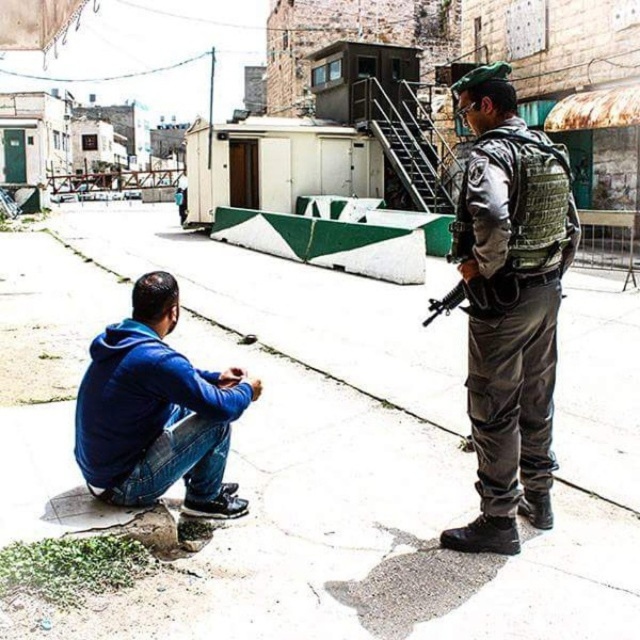
Which is below, smooth concrete pavement at center or camouflage fabric uniform at center?

camouflage fabric uniform at center

Can you confirm if smooth concrete pavement at center is smaller than camouflage fabric uniform at center?

No, smooth concrete pavement at center is not smaller than camouflage fabric uniform at center.

Is point (612, 360) more distant than point (474, 403)?

Yes, it is.

Where is `smooth concrete pavement at center`? smooth concrete pavement at center is located at coordinates (324, 448).

Is camouflage fabric uniform at center positioned at the back of blue fleece jacket at lower left?

No, it is in front of blue fleece jacket at lower left.

Is point (490, 188) more distant than point (234, 499)?

No.

Does point (541, 518) lie in front of point (198, 390)?

No, it is behind (198, 390).

Find the location of `camouflage fabric uniform at center`. camouflage fabric uniform at center is located at coordinates (509, 305).

Is smooth concrete pavement at center bigger than blue fleece jacket at lower left?

Indeed, smooth concrete pavement at center has a larger size compared to blue fleece jacket at lower left.

Is smooth concrete pavement at center in front of blue fleece jacket at lower left?

Yes, smooth concrete pavement at center is in front of blue fleece jacket at lower left.

Where is `smooth concrete pavement at center`? smooth concrete pavement at center is located at coordinates (324, 448).